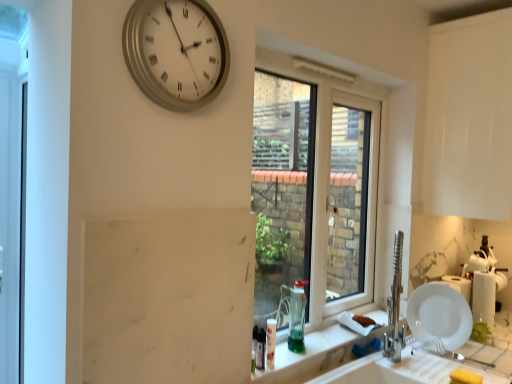
Find the location of a particular element. vacant area on top of green glass at lower center (from a real-world perspective) is located at coordinates (333, 323).